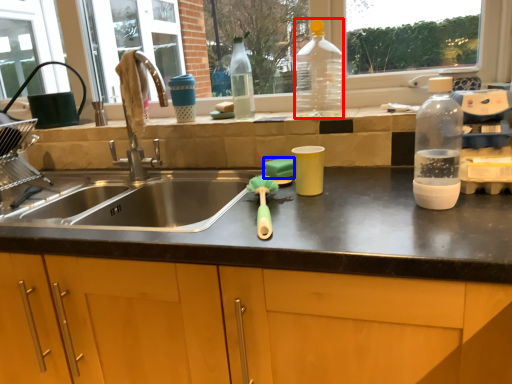
Question: Which object is closer to the camera taking this photo, bottle (highlighted by a red box) or soap (highlighted by a blue box)?

Choices:
 (A) bottle
 (B) soap

Answer: (A)